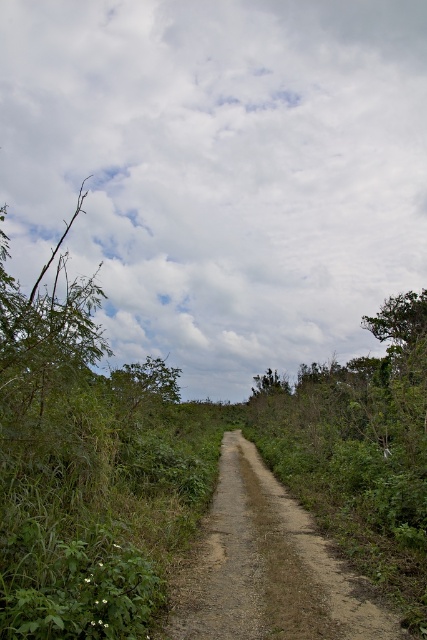
Can you confirm if brown dirt track at center is wider than green leafy tree at center?

Incorrect, brown dirt track at center's width does not surpass green leafy tree at center's.

Which of these two, brown dirt track at center or green leafy tree at center, stands taller?

brown dirt track at center

Identify the location of brown dirt track at center. (268, 566).